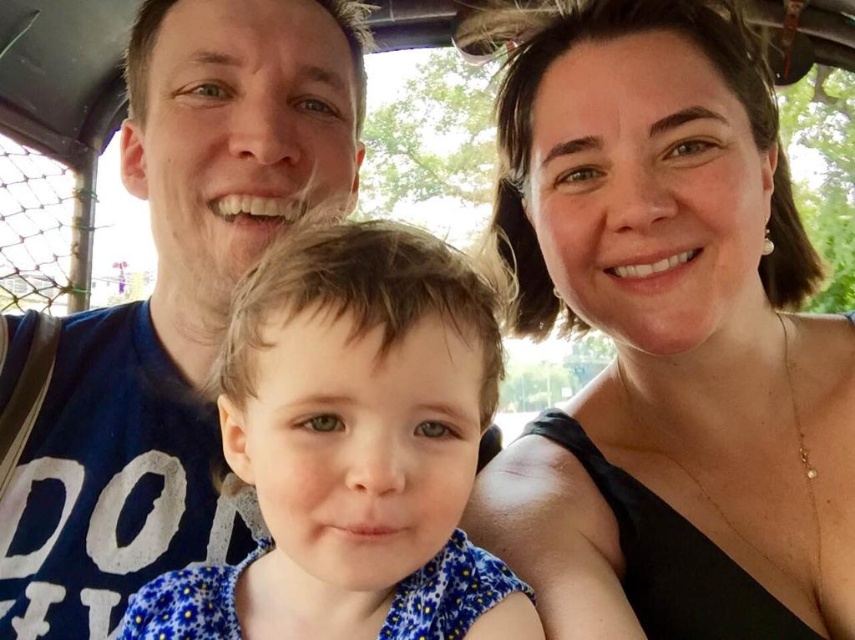
Looking at this image, in the scene described, there are two blue items of clothing. The blue cotton shirt at left and the blue floral dress at center. Which one is positioned more to the left?

The blue cotton shirt at left is positioned more to the left than the blue floral dress at center.

Please describe the location of the matte black top at upper right in the image using coordinates. The coordinate system has the origin at the bottom left corner of the image, with x increasing to the right and y increasing upwards. The values are normalized between 0 and 1. Please provide the coordinates as a tuple of two decimal numbers rounded to three decimal places.

The matte black top at upper right is located at coordinates approximately at point (665, 333).

You are a photographer trying to capture a clear photo of the blue floral dress at center and the matte black top at upper right. Which object is closer to the camera?

The matte black top at upper right is closer to the camera because the blue floral dress at center is behind it.